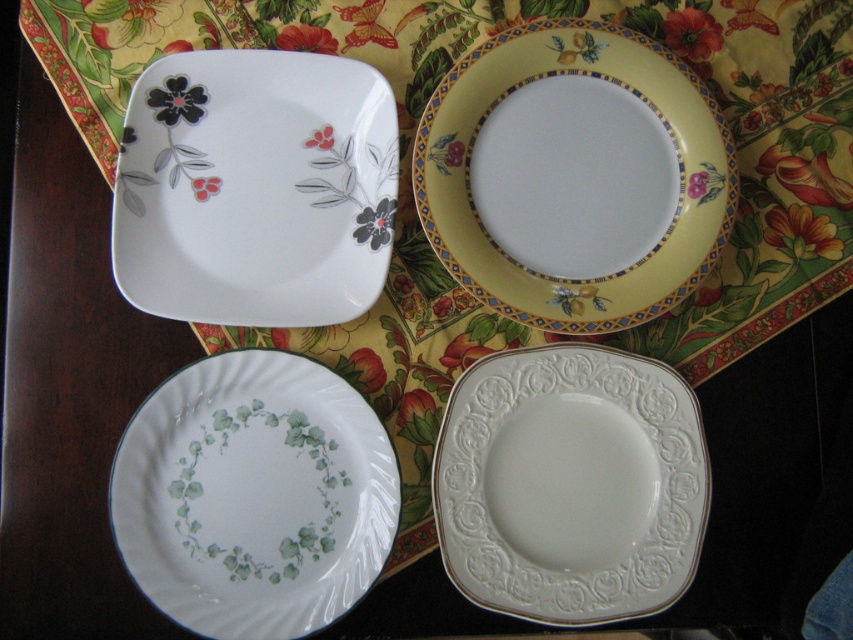
You are standing at the center of the table. Which direction should you move to reach the white porcelain saucer at bottom left?

The white porcelain saucer at bottom left is located at point 0.777 on the x axis and 0.299 on the y axis. Since you are at the center, you should move towards the bottom left direction to reach it.